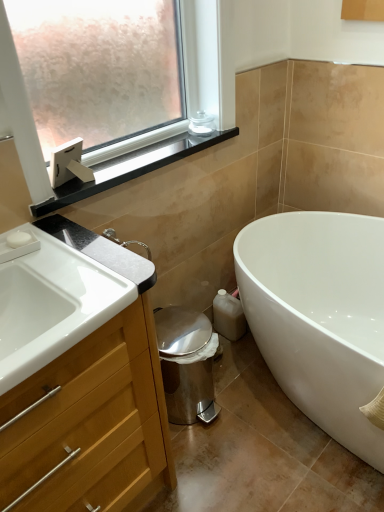
This screenshot has height=512, width=384. Describe the element at coordinates (202, 123) in the screenshot. I see `clear glass jar at upper center` at that location.

The height and width of the screenshot is (512, 384). What do you see at coordinates (130, 168) in the screenshot?
I see `black glossy window sill at upper left` at bounding box center [130, 168].

Find the location of `white glossy bathtub at lower right`. white glossy bathtub at lower right is located at coordinates (320, 315).

Between clear glass jar at upper center and white matte soap at upper left, which one appears on the right side from the viewer's perspective?

clear glass jar at upper center.

From the image's perspective, between clear glass jar at upper center and white matte soap at upper left, who is located below?

white matte soap at upper left appears lower in the image.

Could you tell me if clear glass jar at upper center is turned towards white matte soap at upper left?

No, clear glass jar at upper center is not oriented towards white matte soap at upper left.

Which object is wider, clear glass jar at upper center or white matte soap at upper left?

Wider between the two is clear glass jar at upper center.

From the image's perspective, is clear glass jar at upper center under white glossy sink at lower left?

Result: No, from the image's perspective, clear glass jar at upper center is not below white glossy sink at lower left.

How different are the orientations of clear glass jar at upper center and white glossy sink at lower left in degrees?

The angle between the facing direction of clear glass jar at upper center and the facing direction of white glossy sink at lower left is 1.02 degrees.

Would you consider clear glass jar at upper center to be distant from white glossy sink at lower left?

They are positioned close to each other.

You are a GUI agent. You are given a task and a screenshot of the screen. Output one action in this format:
    pyautogui.click(x=<x>, y=<y>)
    Task: Click on the sink in front of the clear glass jar at upper center
    
    Given the screenshot: What is the action you would take?
    pyautogui.click(x=52, y=305)

Does point (30, 357) come closer to viewer compared to point (31, 239)?

Yes.

Between white glossy sink at lower left and white matte soap at upper left, which one is positioned behind?

white matte soap at upper left is behind.

What's the angular difference between white glossy sink at lower left and white matte soap at upper left's facing directions?

13.4 degrees.

Considering the sizes of white glossy sink at lower left and white matte soap at upper left in the image, is white glossy sink at lower left bigger or smaller than white matte soap at upper left?

Considering their sizes, white glossy sink at lower left takes up more space than white matte soap at upper left.

Which point is more distant from viewer, (322, 303) or (200, 110)?

Point (322, 303)

What's the angular difference between white glossy bathtub at lower right and clear glass jar at upper center's facing directions?

The angular difference between white glossy bathtub at lower right and clear glass jar at upper center is 89.4 degrees.

Can you confirm if white glossy bathtub at lower right is thinner than clear glass jar at upper center?

In fact, white glossy bathtub at lower right might be wider than clear glass jar at upper center.

How many degrees apart are the facing directions of white glossy sink at lower left and white glossy bathtub at lower right?

They differ by 90.5 degrees in their facing directions.

Is white glossy sink at lower left not near white glossy bathtub at lower right?

white glossy sink at lower left is near white glossy bathtub at lower right, not far away.

In the scene shown: Can white glossy bathtub at lower right be found inside white glossy sink at lower left?

Actually, white glossy bathtub at lower right is outside white glossy sink at lower left.

Which object is positioned more to the right, white glossy sink at lower left or white glossy bathtub at lower right?

From the viewer's perspective, white glossy bathtub at lower right appears more on the right side.

Is black glossy window sill at upper left at the right side of white glossy sink at lower left?

Yes, black glossy window sill at upper left is to the right of white glossy sink at lower left.

From the picture: Between black glossy window sill at upper left and white glossy sink at lower left, which one has more height?

Standing taller between the two is white glossy sink at lower left.

Considering the relative sizes of black glossy window sill at upper left and white glossy sink at lower left in the image provided, is black glossy window sill at upper left bigger than white glossy sink at lower left?

No.

The height and width of the screenshot is (512, 384). Identify the location of bathroom cabinet on the left of black glossy window sill at upper left. (76, 384).

Is wooden cabinet at left bigger or smaller than black glossy window sill at upper left?

Clearly, wooden cabinet at left is larger in size than black glossy window sill at upper left.

Where is `toiletry above the white matte soap at upper left (from a real-world perspective)`? toiletry above the white matte soap at upper left (from a real-world perspective) is located at coordinates (202, 123).

Identify the location of sink in front of the clear glass jar at upper center. (52, 305).

Which object lies further to the anchor point white matte soap at upper left, white glossy bathtub at lower right or black glossy window sill at upper left?

Based on the image, white glossy bathtub at lower right appears to be further to white matte soap at upper left.

Consider the image. Estimate the real-world distances between objects in this image. Which object is further from clear glass jar at upper center, white glossy bathtub at lower right or wooden cabinet at left?

wooden cabinet at left is further to clear glass jar at upper center.

Estimate the real-world distances between objects in this image. Which object is closer to clear glass jar at upper center, white glossy bathtub at lower right or white glossy sink at lower left?

Among the two, white glossy bathtub at lower right is located nearer to clear glass jar at upper center.

Which object lies further to the anchor point white glossy bathtub at lower right, black glossy window sill at upper left or white glossy sink at lower left?

The object further to white glossy bathtub at lower right is white glossy sink at lower left.

Based on their spatial positions, is white glossy bathtub at lower right or white glossy sink at lower left closer to black glossy window sill at upper left?

white glossy sink at lower left is positioned closer to the anchor black glossy window sill at upper left.

Based on their spatial positions, is wooden cabinet at left or clear glass jar at upper center further from white glossy sink at lower left?

clear glass jar at upper center.

Considering their positions, is clear glass jar at upper center positioned further to wooden cabinet at left than white glossy sink at lower left?

Among the two, clear glass jar at upper center is located further to wooden cabinet at left.

When comparing their distances from clear glass jar at upper center, does white matte soap at upper left or black glossy window sill at upper left seem closer?

Based on the image, black glossy window sill at upper left appears to be nearer to clear glass jar at upper center.

Where is `bathroom cabinet between white matte soap at upper left and white glossy bathtub at lower right`? The height and width of the screenshot is (512, 384). bathroom cabinet between white matte soap at upper left and white glossy bathtub at lower right is located at coordinates (76, 384).

I want to click on bathtub between clear glass jar at upper center and wooden cabinet at left in the vertical direction, so click(320, 315).

Locate an element on the screen. bathroom cabinet between white glossy sink at lower left and white glossy bathtub at lower right in the horizontal direction is located at coordinates (76, 384).

Where is `sink positioned between wooden cabinet at left and clear glass jar at upper center from near to far`? sink positioned between wooden cabinet at left and clear glass jar at upper center from near to far is located at coordinates (52, 305).